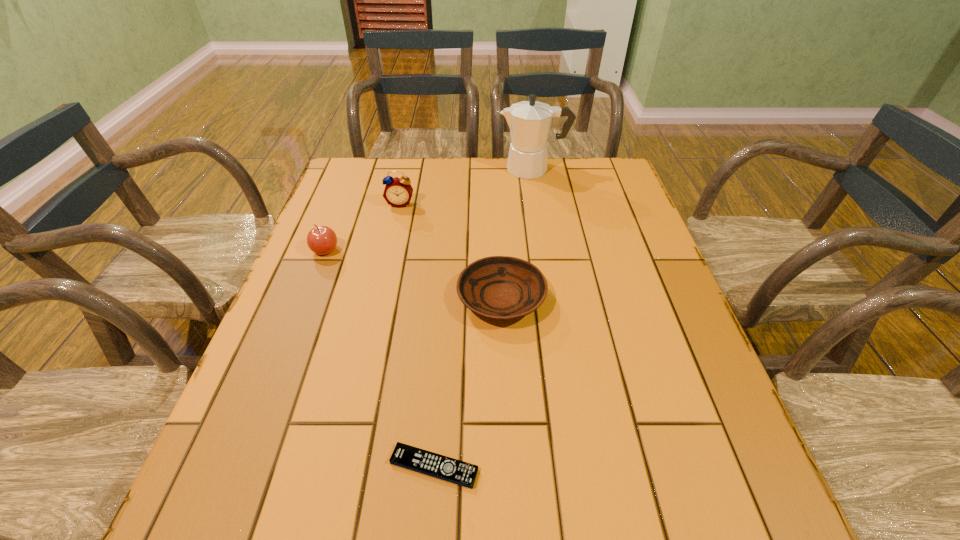
Where is `free space that satisfies the following two spatial constraints: 1. on the front-facing side of the second farthest object; 2. on the left side of the plate`? free space that satisfies the following two spatial constraints: 1. on the front-facing side of the second farthest object; 2. on the left side of the plate is located at coordinates (379, 298).

Locate an element on the screen. The image size is (960, 540). vacant space that satisfies the following two spatial constraints: 1. on the back side of the plate; 2. on the right side of the nearest object is located at coordinates (446, 298).

What are the coordinates of `vacant space that satisfies the following two spatial constraints: 1. on the front side of the remote control; 2. on the right side of the leftmost object` in the screenshot? It's located at (242, 467).

Find the location of a particular element. This screenshot has width=960, height=540. vacant space that satisfies the following two spatial constraints: 1. on the front-facing side of the shortest object; 2. on the left side of the fourth nearest object is located at coordinates (341, 467).